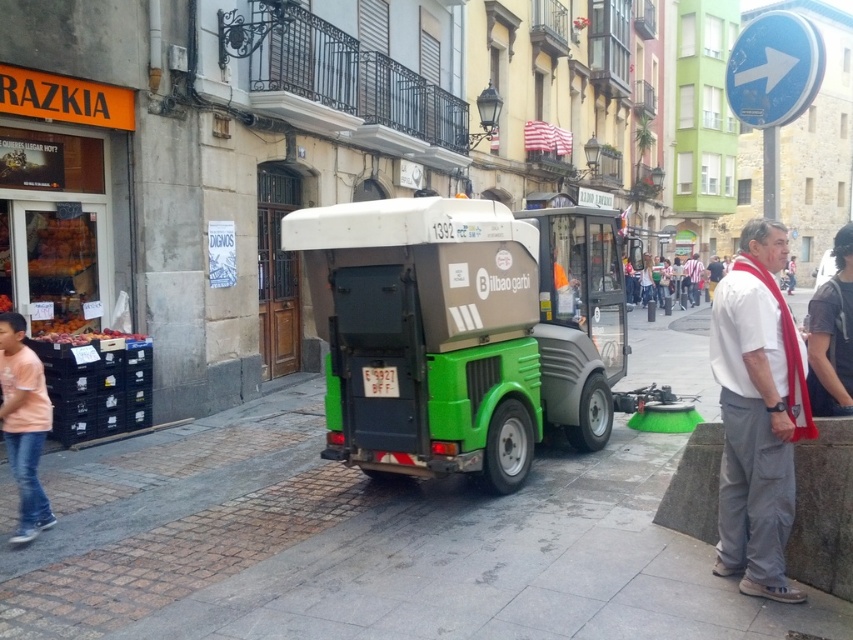
Does green matte cleaning cart at center have a greater height compared to pink cotton shirt at lower left?

Yes, green matte cleaning cart at center is taller than pink cotton shirt at lower left.

Which is above, green matte cleaning cart at center or pink cotton shirt at lower left?

green matte cleaning cart at center is above.

Does point (561, 380) come farther from viewer compared to point (18, 477)?

That is True.

The width and height of the screenshot is (853, 640). Find the location of `green matte cleaning cart at center`. green matte cleaning cart at center is located at coordinates (459, 332).

Is point (30, 520) positioned before point (827, 344)?

No, (30, 520) is further to viewer.

Is point (18, 524) farther from viewer compared to point (824, 385)?

Yes, point (18, 524) is farther from viewer.

What are the coordinates of `pink cotton shirt at lower left` in the screenshot? It's located at (22, 422).

The height and width of the screenshot is (640, 853). Describe the element at coordinates (364, 545) in the screenshot. I see `green rubber pavement at center` at that location.

Does green rubber pavement at center have a greater height compared to red scarf at right?

In fact, green rubber pavement at center may be shorter than red scarf at right.

Between point (302, 388) and point (836, 412), which one is positioned behind?

The point (302, 388) is behind.

Where is `green rubber pavement at center`? The height and width of the screenshot is (640, 853). green rubber pavement at center is located at coordinates (364, 545).